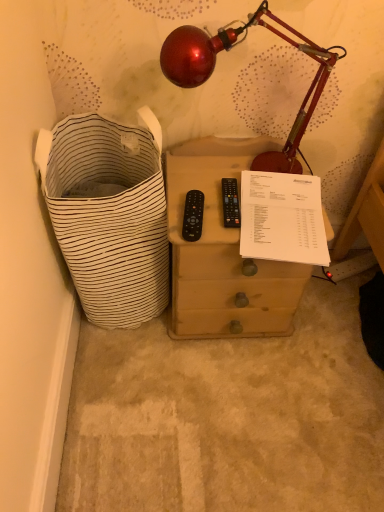
Identify the location of vacant space situated on the left part of black plastic remote at center, which ranks as the first control in right-to-left order. coord(186,193).